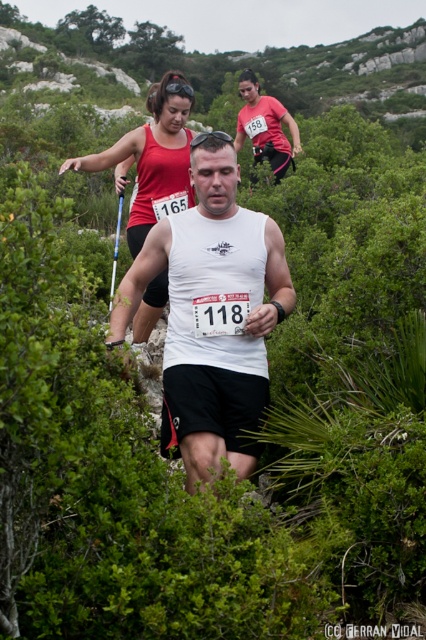
Is white matte tank top at center wider than matte red tank top at center?

In fact, white matte tank top at center might be narrower than matte red tank top at center.

You are a GUI agent. You are given a task and a screenshot of the screen. Output one action in this format:
    pyautogui.click(x=<x>, y=<y>)
    Task: Click on the white matte tank top at center
    
    Given the screenshot: What is the action you would take?
    pyautogui.click(x=210, y=307)

Who is positioned more to the right, matte red tank top at center or matte white tank top at center?

Positioned to the right is matte white tank top at center.

Does matte red tank top at center appear over matte white tank top at center?

No.

Is point (187, 156) positioned in front of point (279, 109)?

That is True.

Find the location of a particular element. This screenshot has width=426, height=640. matte red tank top at center is located at coordinates (152, 157).

Is white matte tank top at center thinner than matte white tank top at center?

Indeed, white matte tank top at center has a lesser width compared to matte white tank top at center.

Does point (247, 397) lie in front of point (242, 120)?

Yes, it is.

This screenshot has width=426, height=640. Identify the location of white matte tank top at center. (210, 307).